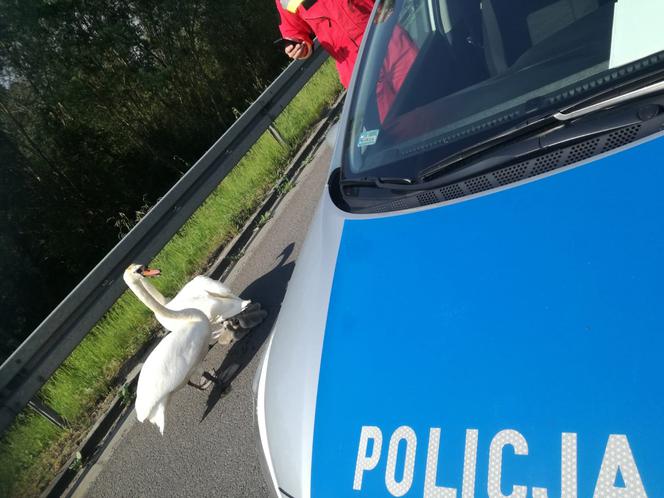
Where is `hood`? hood is located at coordinates (473, 294).